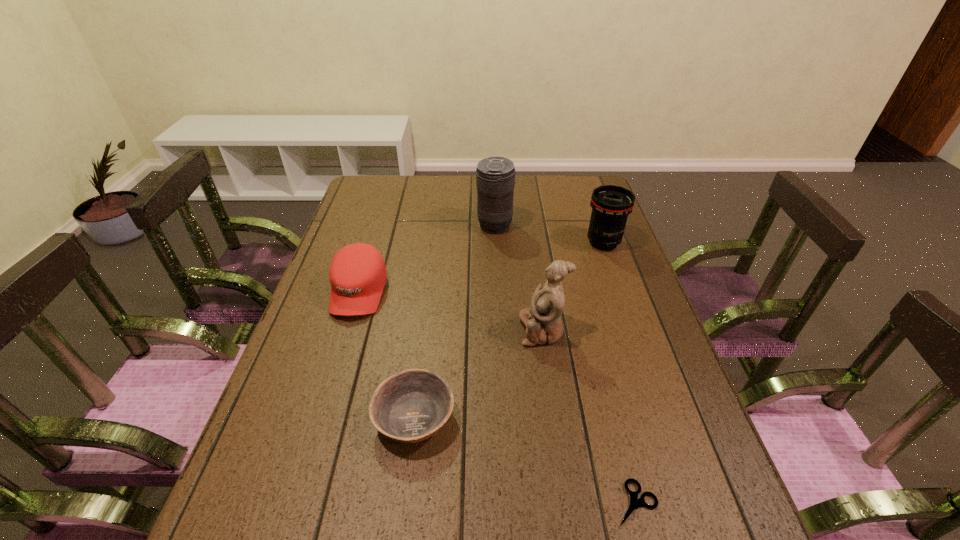
Identify the location of free space located 0.050m on the side of the taller telephoto lens where the control switches are located. The height and width of the screenshot is (540, 960). (462, 226).

What are the coordinates of `vacant area situated 0.230m on the side of the taller telephoto lens where the control switches are located` in the screenshot? It's located at (408, 226).

I want to click on free space located on the side of the taller telephoto lens where the control switches are located, so click(x=372, y=226).

Where is `free location located 0.280m on the front-facing side of the figurine`? The width and height of the screenshot is (960, 540). free location located 0.280m on the front-facing side of the figurine is located at coordinates (410, 330).

This screenshot has height=540, width=960. In order to click on free space located 0.210m on the front-facing side of the figurine in this screenshot , I will do `click(438, 330)`.

Find the location of `vacant space situated 0.110m on the front-facing side of the figurine`. vacant space situated 0.110m on the front-facing side of the figurine is located at coordinates (476, 330).

Locate an element on the screen. This screenshot has height=540, width=960. free space located on the back of the rightmost object is located at coordinates (590, 207).

Where is `vacant position located 0.210m on the front-facing side of the cap`? The image size is (960, 540). vacant position located 0.210m on the front-facing side of the cap is located at coordinates (328, 391).

Identify the location of free spot located on the right of the bowl. This screenshot has width=960, height=540. (483, 417).

Image resolution: width=960 pixels, height=540 pixels. Identify the location of vacant region located on the back of the second object from right to left. (592, 332).